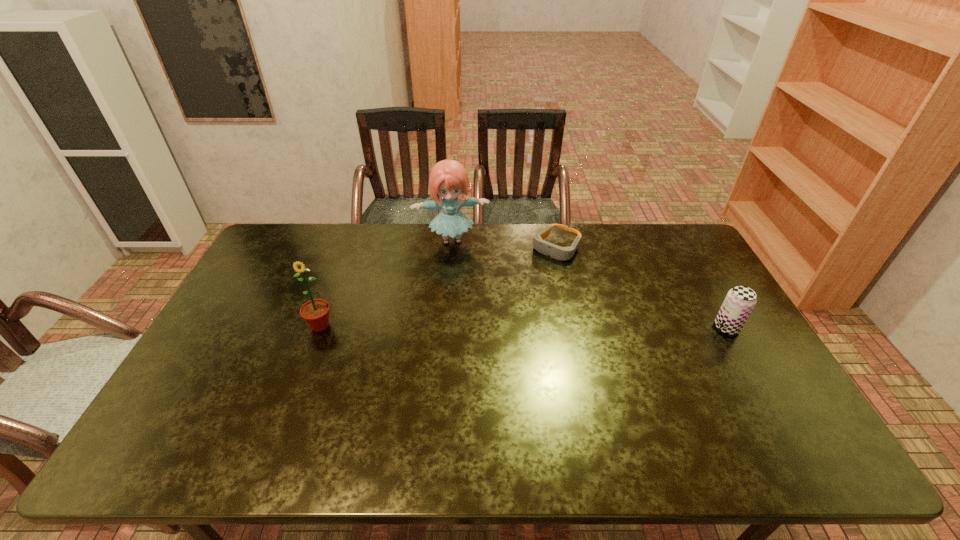
At what (x,y) coordinates should I click in order to perform the action: click on sunflower. Please return your answer as a coordinate pair (x, y). Looking at the image, I should click on click(315, 312).

Where is `the leftmost object`? the leftmost object is located at coordinates (315, 312).

At what (x,y) coordinates should I click in order to perform the action: click on beer can. Please return your answer as a coordinate pair (x, y). Looking at the image, I should click on (740, 300).

This screenshot has width=960, height=540. What are the coordinates of `the third tallest object` in the screenshot? It's located at (740, 300).

Where is `the shortest object`? the shortest object is located at coordinates (557, 252).

Where is `the third object from left to right`? This screenshot has height=540, width=960. the third object from left to right is located at coordinates (557, 252).

What are the coordinates of `doll` in the screenshot? It's located at (448, 178).

This screenshot has width=960, height=540. In order to click on the second object from left to right in this screenshot , I will do `click(448, 178)`.

Identify the location of blank space located 0.150m on the face of the sunflower. (300, 379).

The height and width of the screenshot is (540, 960). Find the location of `vacant space located 0.200m on the front of the third tallest object`. vacant space located 0.200m on the front of the third tallest object is located at coordinates (766, 396).